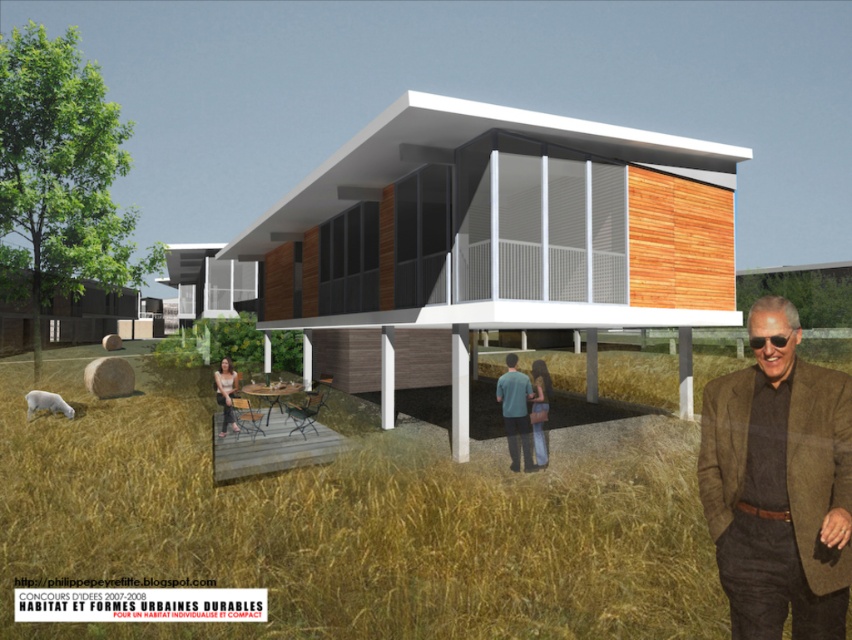
Question: Which object appears farthest from the camera in this image?

Choices:
 (A) matte brown hair at lower center
 (B) teal fabric shirt at center
 (C) brown wool jacket at lower right

Answer: (A)

Question: Is brown wool jacket at lower right positioned at the back of blue jeans at lower center?

Choices:
 (A) no
 (B) yes

Answer: (A)

Question: Does teal fabric shirt at center appear over matte brown hair at lower center?

Choices:
 (A) no
 (B) yes

Answer: (A)

Question: In this image, where is teal fabric shirt at center located relative to blue jeans at lower center?

Choices:
 (A) above
 (B) below

Answer: (B)

Question: Which point appears closest to the camera in this image?

Choices:
 (A) (222, 378)
 (B) (545, 442)
 (C) (832, 550)
 (D) (510, 387)

Answer: (C)

Question: Which object appears farthest from the camera in this image?

Choices:
 (A) brown wool jacket at lower right
 (B) teal fabric shirt at center

Answer: (B)